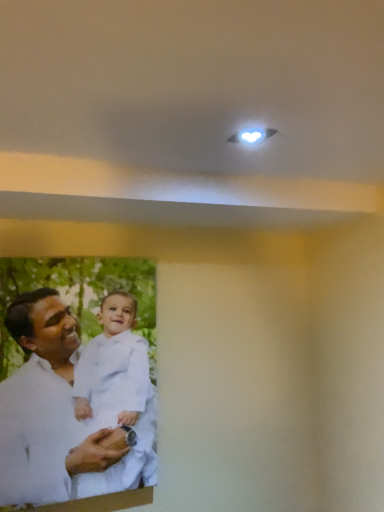
The height and width of the screenshot is (512, 384). Describe the element at coordinates (43, 406) in the screenshot. I see `white cotton shirt at left` at that location.

Find the location of a particular element. This screenshot has width=384, height=512. white cotton shirt at left is located at coordinates (43, 406).

What are the coordinates of `white cotton shirt at left` in the screenshot? It's located at (43, 406).